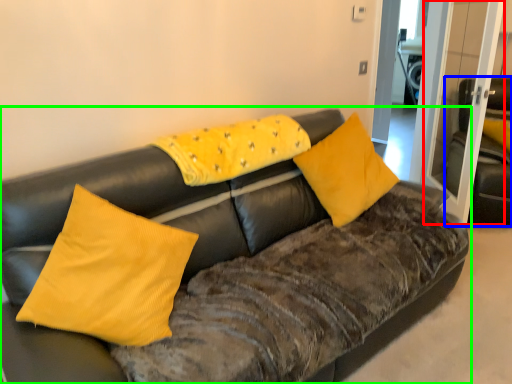
Question: Based on their relative distances, which object is nearer to glass door (highlighted by a red box)? Choose from armchair (highlighted by a blue box) and studio couch (highlighted by a green box).

Choices:
 (A) armchair
 (B) studio couch

Answer: (A)